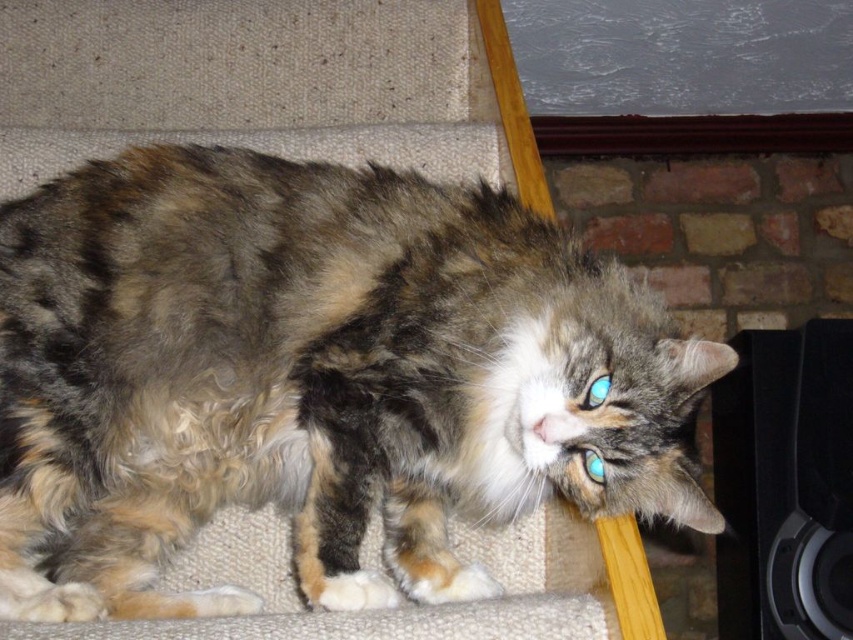
Question: Which of the following is the farthest from the observer?

Choices:
 (A) black matte speaker at right
 (B) fuzzy fur cat at center

Answer: (A)

Question: Can you confirm if fuzzy fur cat at center is thinner than black matte speaker at right?

Choices:
 (A) yes
 (B) no

Answer: (B)

Question: Does fuzzy fur cat at center appear over black matte speaker at right?

Choices:
 (A) yes
 (B) no

Answer: (A)

Question: Does fuzzy fur cat at center appear under black matte speaker at right?

Choices:
 (A) yes
 (B) no

Answer: (B)